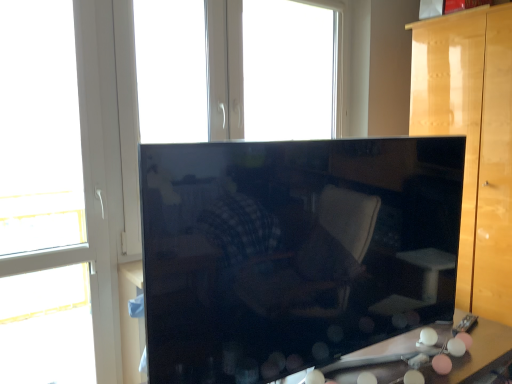
Question: From the image's perspective, is glossy wood cabinet at right located above or below white plastic window at upper center, which is the second window in front-to-back order?

Choices:
 (A) above
 (B) below

Answer: (B)

Question: From a real-world perspective, is glossy wood cabinet at right positioned above or below white plastic window at upper center, the 2th window when ordered from left to right?

Choices:
 (A) below
 (B) above

Answer: (A)

Question: Which object is the closest to the white plastic window at left, the 1th window from the left?

Choices:
 (A) glossy wood cabinet at center
 (B) matte plastic table at lower right
 (C) white plastic window at upper center, placed as the first window when sorted from right to left
 (D) glossy wood cabinet at right

Answer: (A)

Question: Which object is positioned closest to the glossy wood cabinet at center?

Choices:
 (A) matte plastic table at lower right
 (B) glossy wood cabinet at right
 (C) white plastic window at left, the 1th window from the left
 (D) white plastic window at upper center, which is the second window in front-to-back order

Answer: (A)